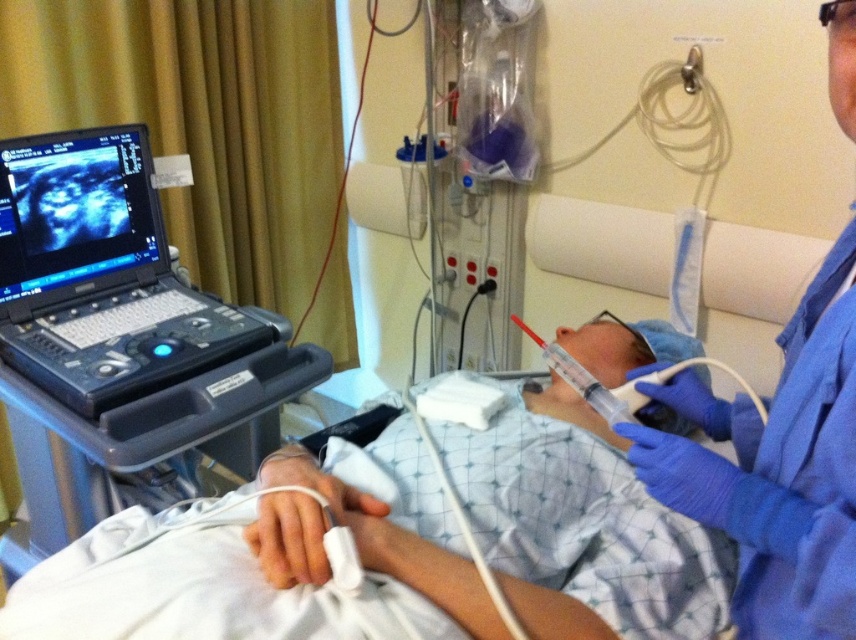
Is black plastic laptop at upper left further to camera compared to matte black monitor at upper left?

No, it is in front of matte black monitor at upper left.

Does point (16, 284) come behind point (76, 150)?

No, (16, 284) is in front of (76, 150).

Between point (229, 324) and point (159, 259), which one is positioned behind?

The point (159, 259) is behind.

The image size is (856, 640). In order to click on black plastic laptop at upper left in this screenshot , I will do `click(100, 275)`.

Who is positioned more to the left, blue latex gloves at upper right or black plastic laptop at upper left?

black plastic laptop at upper left

Is point (724, 472) positioned behind point (146, 376)?

That is False.

The width and height of the screenshot is (856, 640). I want to click on blue latex gloves at upper right, so click(776, 468).

Who is lower down, blue latex gloves at upper right or matte black monitor at upper left?

blue latex gloves at upper right is below.

Between point (752, 493) and point (88, 129), which one is positioned in front?

Positioned in front is point (752, 493).

Describe the element at coordinates (776, 468) in the screenshot. I see `blue latex gloves at upper right` at that location.

Locate an element on the screen. The width and height of the screenshot is (856, 640). blue latex gloves at upper right is located at coordinates (776, 468).